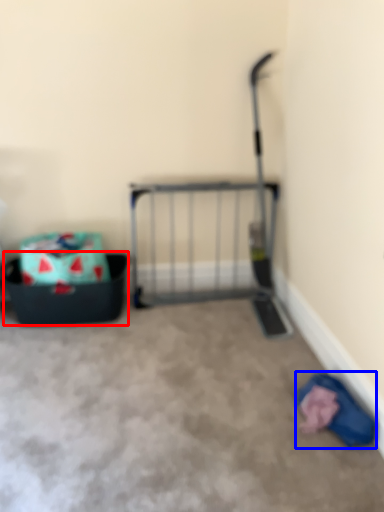
Question: Which of the following is the closest to the observer, storage box (highlighted by a red box) or clothing (highlighted by a blue box)?

Choices:
 (A) storage box
 (B) clothing

Answer: (B)